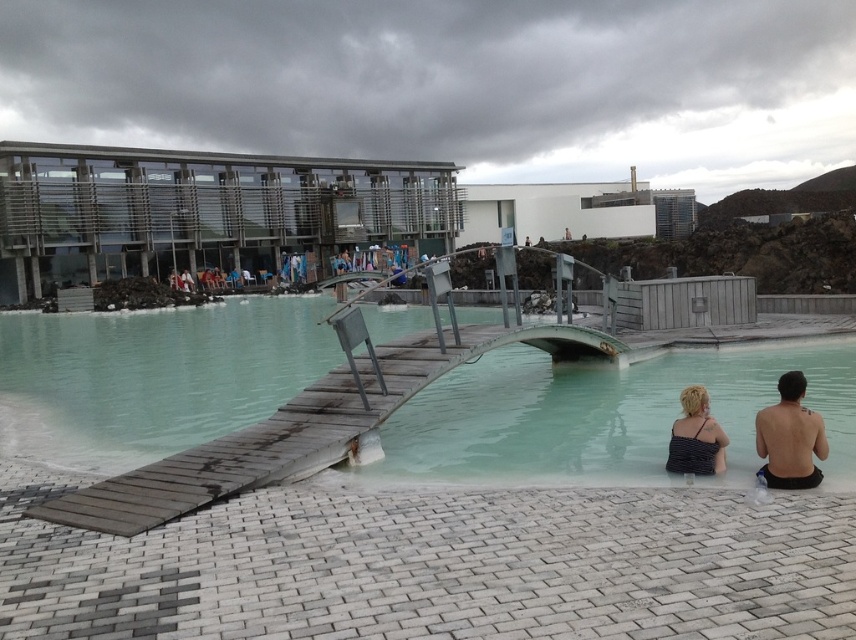
You are a photographer standing on the paved walkway and want to capture both the translucent wooden bridge at center and the shiny skin at lower right in a single frame. Given their height difference, will you need to adjust your camera angle upwards or downwards to include both in the photo?

The translucent wooden bridge at center is much taller than the shiny skin at lower right, so you will need to adjust your camera angle downwards to include both in the photo.

You are standing on the paved walkway in the foreground and want to reach the modern building with large glass windows. Which direction should you head towards relative to the clear turquoise water at center?

You should head towards the direction opposite of the clear turquoise water at center, as the modern building is located on the far side of the bridge which spans over the water. Since the water is at the center, moving away from it towards the bridge would lead you to the building.